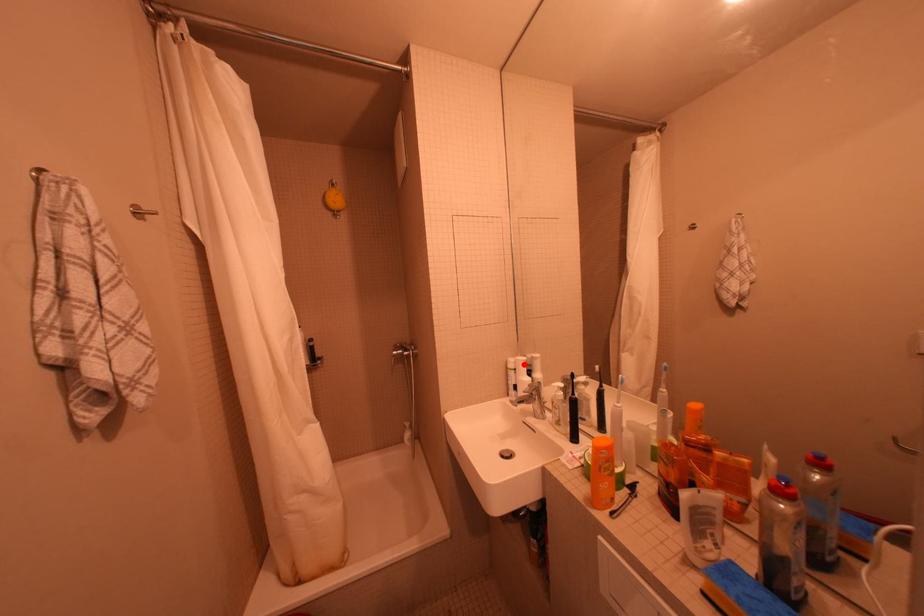
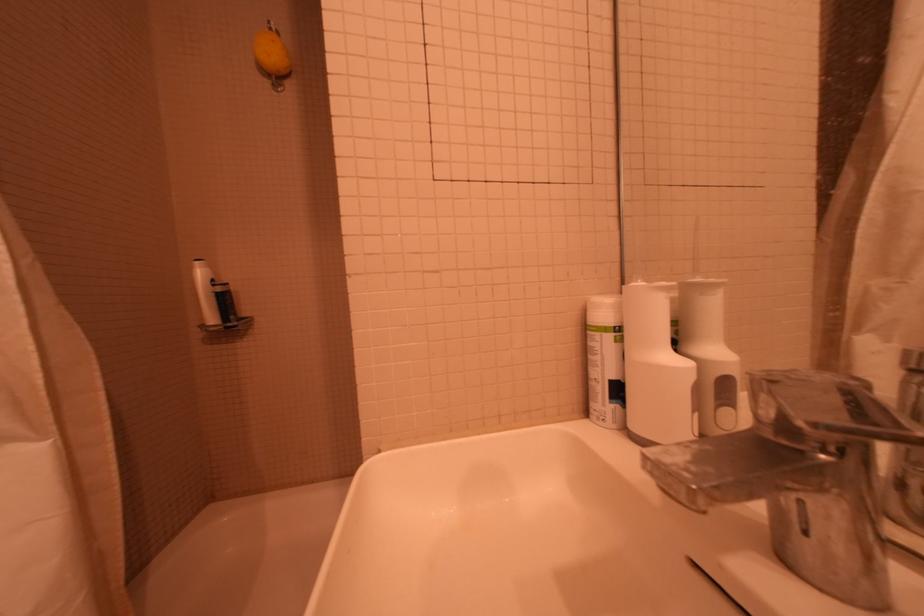
In the second image, find the point that corresponds to the highlighted location in the first image.

(627, 309)